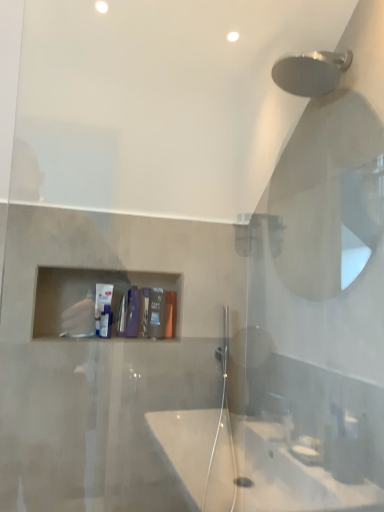
Question: From a real-world perspective, is matte plastic container at center, the first toiletry from the right, beneath white matte tube at center, positioned as the 3th toiletry in right-to-left order?

Choices:
 (A) yes
 (B) no

Answer: (A)

Question: Can you confirm if matte plastic container at center, marked as the 3th toiletry in a left-to-right arrangement, is smaller than white matte tube at center, positioned as the 3th toiletry in right-to-left order?

Choices:
 (A) yes
 (B) no

Answer: (A)

Question: Would you say matte plastic container at center, the first toiletry from the right, contains white matte tube at center, which is the 1th toiletry from left to right?

Choices:
 (A) no
 (B) yes

Answer: (A)

Question: Is matte plastic container at center, marked as the 3th toiletry in a left-to-right arrangement, shorter than white matte tube at center, which is the 1th toiletry from left to right?

Choices:
 (A) yes
 (B) no

Answer: (A)

Question: Is the depth of matte plastic container at center, marked as the 3th toiletry in a left-to-right arrangement, greater than that of white matte tube at center, positioned as the 3th toiletry in right-to-left order?

Choices:
 (A) no
 (B) yes

Answer: (B)

Question: From a real-world perspective, relative to matte plastic container at center, the first toiletry from the right, is white matte tube at center, which is the 1th toiletry from left to right, vertically above or below?

Choices:
 (A) below
 (B) above

Answer: (B)

Question: From the image's perspective, relative to matte plastic container at center, marked as the 3th toiletry in a left-to-right arrangement, is white matte tube at center, positioned as the 3th toiletry in right-to-left order, above or below?

Choices:
 (A) above
 (B) below

Answer: (A)

Question: In terms of width, does white matte tube at center, positioned as the 3th toiletry in right-to-left order, look wider or thinner when compared to matte plastic container at center, marked as the 3th toiletry in a left-to-right arrangement?

Choices:
 (A) wide
 (B) thin

Answer: (B)

Question: Is point (107, 290) positioned closer to the camera than point (168, 318)?

Choices:
 (A) closer
 (B) farther

Answer: (A)

Question: Is white matte tube at center, which is the 1th toiletry from left to right, wider or thinner than matte black soap at center, which is the 2th toiletry from left to right?

Choices:
 (A) thin
 (B) wide

Answer: (A)

Question: Is white matte tube at center, positioned as the 3th toiletry in right-to-left order, taller or shorter than matte black soap at center, acting as the 2th toiletry starting from the right?

Choices:
 (A) tall
 (B) short

Answer: (A)

Question: Based on their sizes in the image, would you say white matte tube at center, positioned as the 3th toiletry in right-to-left order, is bigger or smaller than matte black soap at center, which is the 2th toiletry from left to right?

Choices:
 (A) small
 (B) big

Answer: (B)

Question: Choose the correct answer: Is white matte tube at center, positioned as the 3th toiletry in right-to-left order, inside matte black soap at center, which is the 2th toiletry from left to right, or outside it?

Choices:
 (A) inside
 (B) outside

Answer: (B)

Question: Does point (155, 293) appear closer or farther from the camera than point (99, 283)?

Choices:
 (A) farther
 (B) closer

Answer: (A)

Question: From their relative heights in the image, would you say matte black soap at center, acting as the 2th toiletry starting from the right, is taller or shorter than white matte tube at center, positioned as the 3th toiletry in right-to-left order?

Choices:
 (A) short
 (B) tall

Answer: (A)